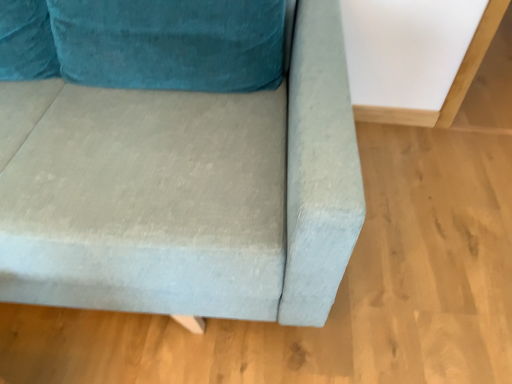
This screenshot has height=384, width=512. What do you see at coordinates (185, 192) in the screenshot?
I see `suede gray couch at center` at bounding box center [185, 192].

Where is `suede gray couch at center`? This screenshot has width=512, height=384. suede gray couch at center is located at coordinates (185, 192).

What is the approximate width of suede gray couch at center?

suede gray couch at center is 3.53 feet in width.

Where is `suede gray couch at center`? This screenshot has height=384, width=512. suede gray couch at center is located at coordinates (185, 192).